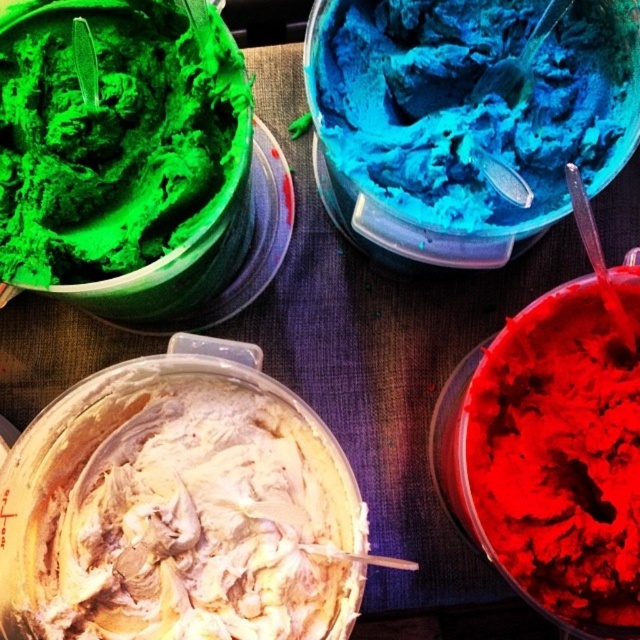
Who is positioned more to the left, whipped cream at center or matte red frosting at bottom right?

From the viewer's perspective, whipped cream at center appears more on the left side.

In the scene shown: Who is more distant from viewer, [273,458] or [493,433]?

The point [273,458] is behind.

Locate an element on the screen. This screenshot has width=640, height=640. whipped cream at center is located at coordinates (192, 518).

Is whipped cream at center smaller than green matte ice cream at upper left?

No.

Can you confirm if whipped cream at center is positioned to the left of green matte ice cream at upper left?

Incorrect, whipped cream at center is not on the left side of green matte ice cream at upper left.

Is point (96, 413) closer to viewer compared to point (182, 205)?

No, it is behind (182, 205).

The height and width of the screenshot is (640, 640). I want to click on whipped cream at center, so click(x=192, y=518).

Does point (108, 51) come closer to viewer compared to point (564, 408)?

That is False.

Can you confirm if green matte ice cream at upper left is wider than matte red frosting at bottom right?

Yes, green matte ice cream at upper left is wider than matte red frosting at bottom right.

Who is more distant from viewer, (140, 129) or (486, 372)?

The point (140, 129) is more distant.

Find the location of `green matte ice cream at upper left`. green matte ice cream at upper left is located at coordinates (112, 138).